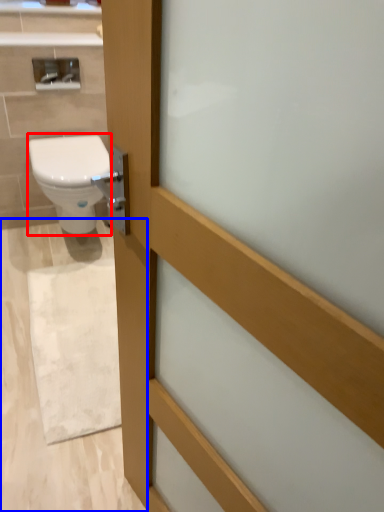
Question: Among these objects, which one is nearest to the camera, bidet (highlighted by a red box) or plain (highlighted by a blue box)?

Choices:
 (A) bidet
 (B) plain

Answer: (B)